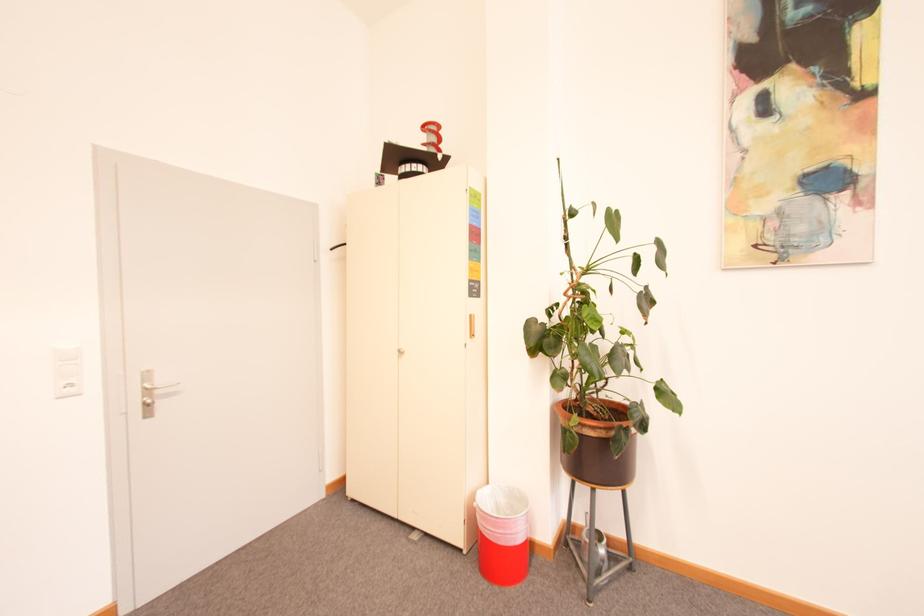
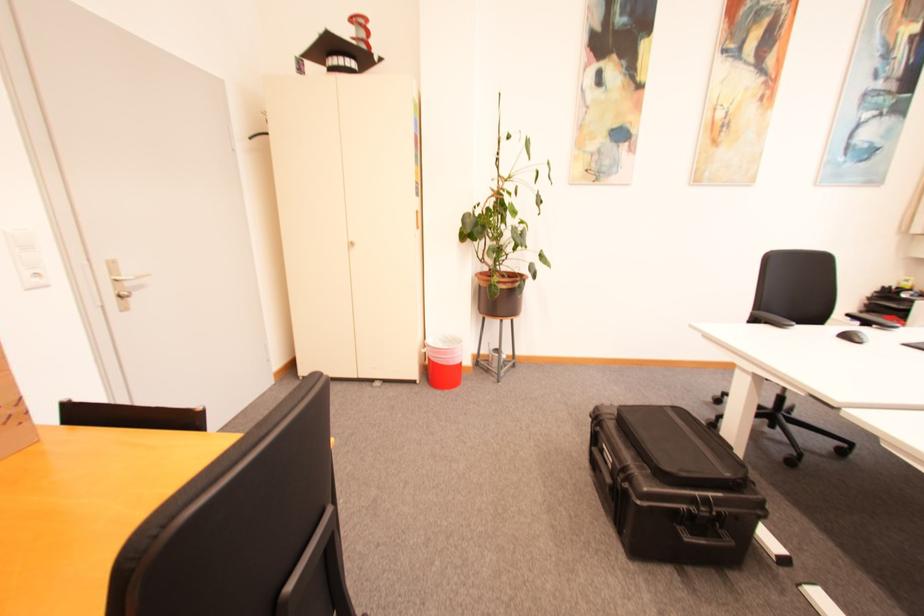
The point at (407,353) is marked in the first image. Where is the corresponding point in the second image?

(359, 245)